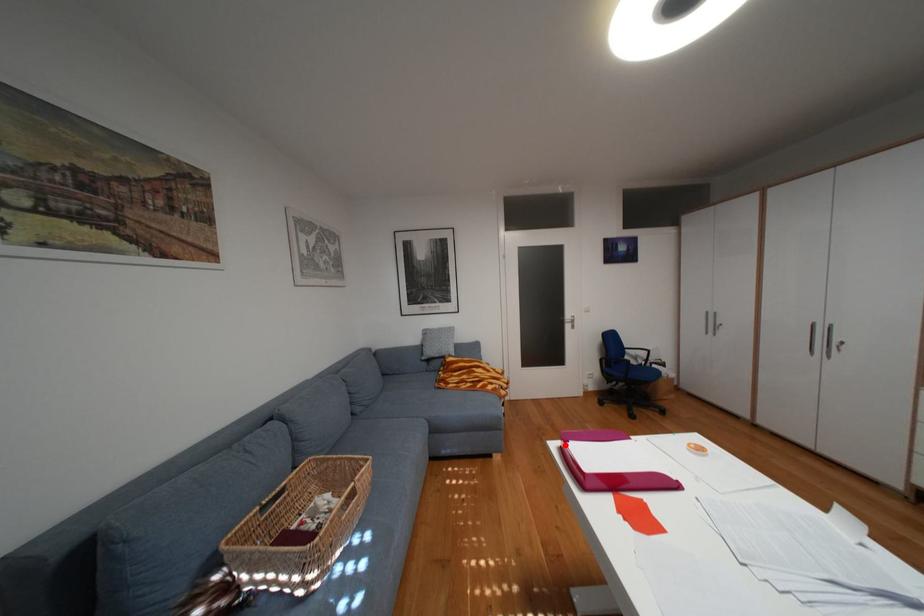
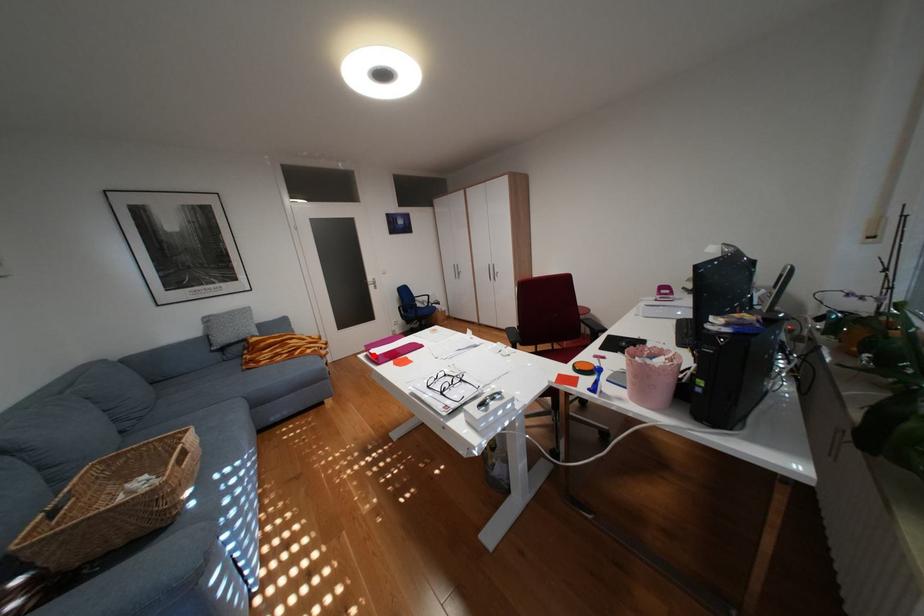
I am providing you with two images of the same scene from different viewpoints. A red point is marked on the first image and another point is marked on the second image. Is the red point in image1 aligned with the point shown in image2?

Yes